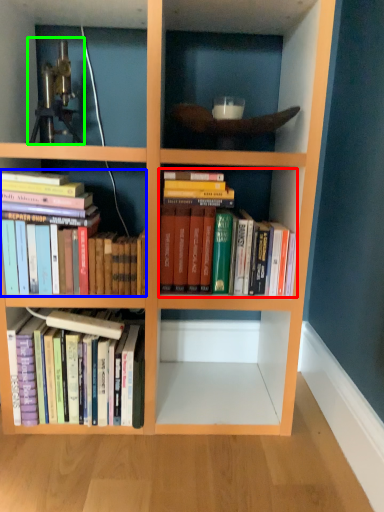
Question: Which is farther away from book (highlighted by a red box)? book (highlighted by a blue box) or telescope (highlighted by a green box)?

Choices:
 (A) book
 (B) telescope

Answer: (B)